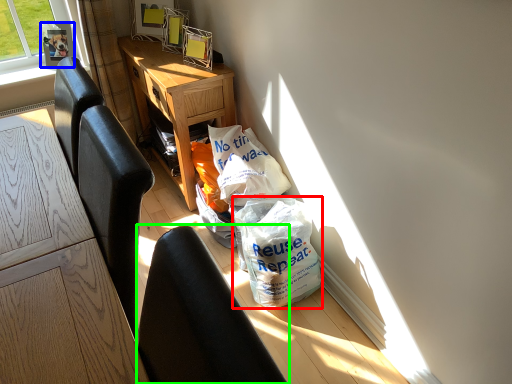
Question: Which is farther away from plastic bag (highlighted by a red box)? picture frame (highlighted by a blue box) or chair (highlighted by a green box)?

Choices:
 (A) picture frame
 (B) chair

Answer: (A)